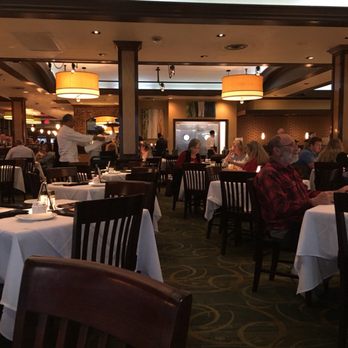
At what (x,y) coordinates should I click in order to perform the action: click on large light fixture. Please return your answer as a coordinate pair (x, y). This screenshot has width=348, height=348. Looking at the image, I should click on (76, 82), (238, 88).